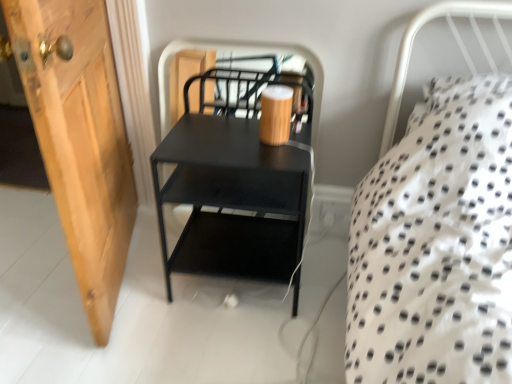
Find the location of a particular element. vacant region to the left of wooden door at left is located at coordinates tap(34, 250).